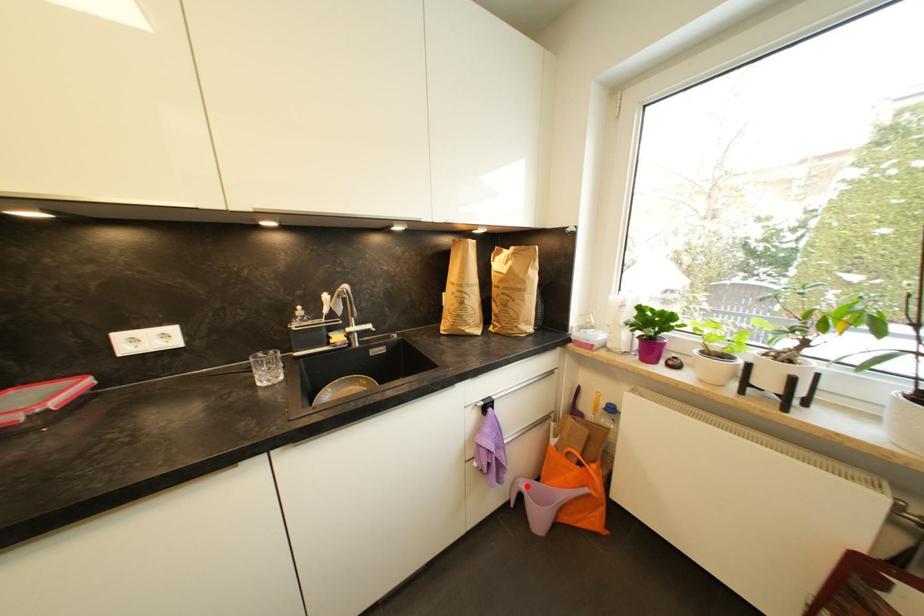
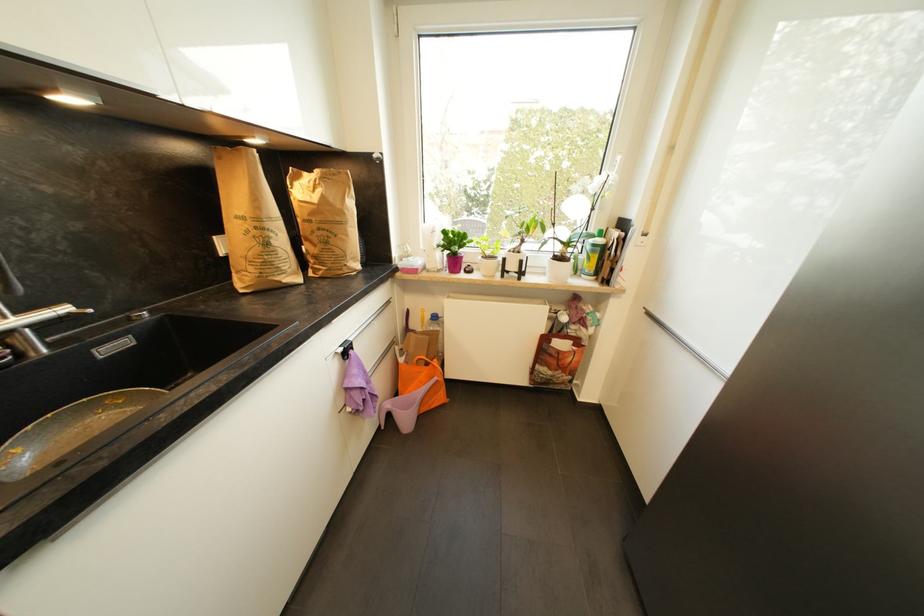
The point at the highlighted location is marked in the first image. Where is the corresponding point in the second image?

(393, 407)